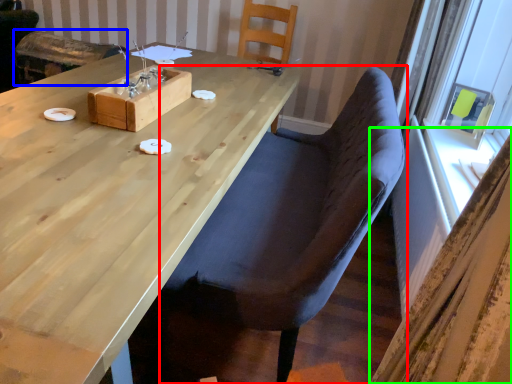
Question: Which is nearer to the chair (highlighted by a red box)? armchair (highlighted by a blue box) or curtain (highlighted by a green box).

Choices:
 (A) armchair
 (B) curtain

Answer: (B)